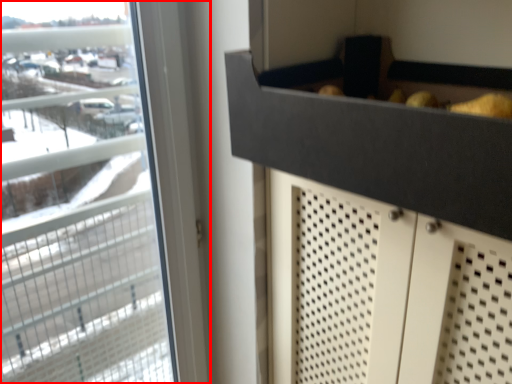
Question: Where is window (annotated by the red box) located in relation to drawer in the image?

Choices:
 (A) right
 (B) left

Answer: (B)